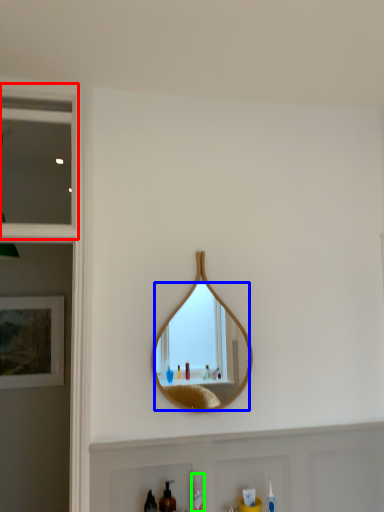
Question: Estimate the real-world distances between objects in this image. Which object is farther from window (highlighted by a red box), mirror (highlighted by a blue box) or mouthwash (highlighted by a green box)?

Choices:
 (A) mirror
 (B) mouthwash

Answer: (A)